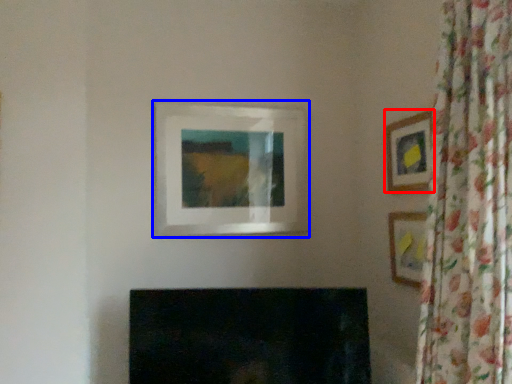
Question: Which of the following is the closest to the observer, picture frame (highlighted by a red box) or picture frame (highlighted by a blue box)?

Choices:
 (A) picture frame
 (B) picture frame

Answer: (A)